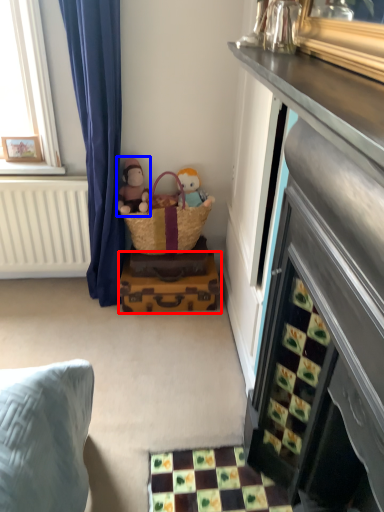
Question: Among these objects, which one is farthest to the camera, luggage (highlighted by a red box) or doll (highlighted by a blue box)?

Choices:
 (A) luggage
 (B) doll

Answer: (A)